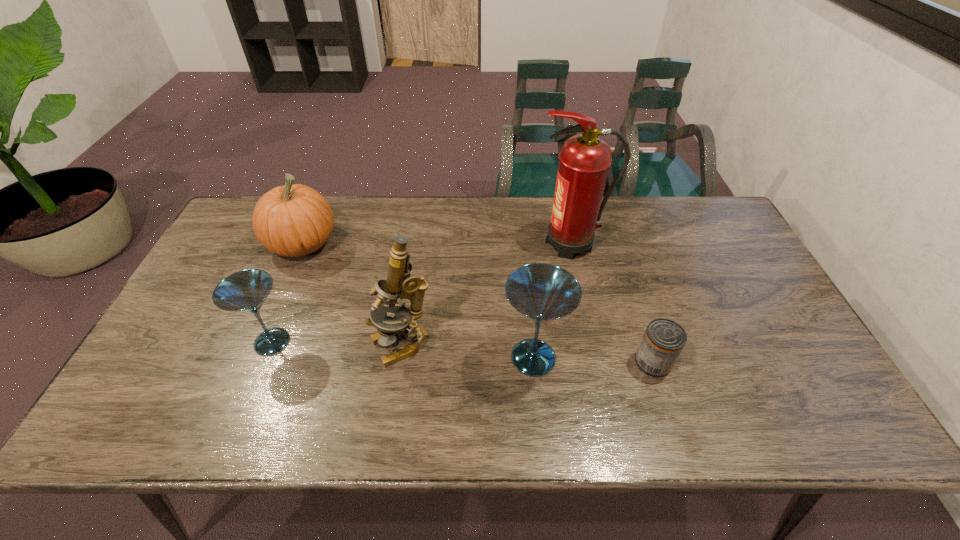
Image resolution: width=960 pixels, height=540 pixels. Identify the location of free space located 0.090m on the stem of the pumpkin. point(368,244).

Locate an element on the screen. Image resolution: width=960 pixels, height=540 pixels. free location located on the front-facing side of the tallest object is located at coordinates (508, 244).

Locate an element on the screen. Image resolution: width=960 pixels, height=540 pixels. vacant space situated 0.370m on the front-facing side of the tallest object is located at coordinates (417, 244).

At what (x,y) coordinates should I click in order to perform the action: click on vacant area located on the front-facing side of the tallest object. Please return your answer as a coordinate pair (x, y). The image size is (960, 540). Looking at the image, I should click on (486, 244).

Identify the location of free space located 0.060m on the left of the second tallest object. This screenshot has height=540, width=960. (347, 346).

What are the coordinates of `vacant point located 0.060m on the back of the shortest object` in the screenshot? It's located at (642, 328).

This screenshot has height=540, width=960. Identify the location of pumpkin that is positioned at the far edge. click(295, 220).

Identify the location of fire extinguisher situated at the far edge. (584, 160).

Identify the location of martini that is positioned at the near edge. The image size is (960, 540). (543, 292).

Locate an element on the screen. The width and height of the screenshot is (960, 540). microscope positioned at the near edge is located at coordinates (399, 284).